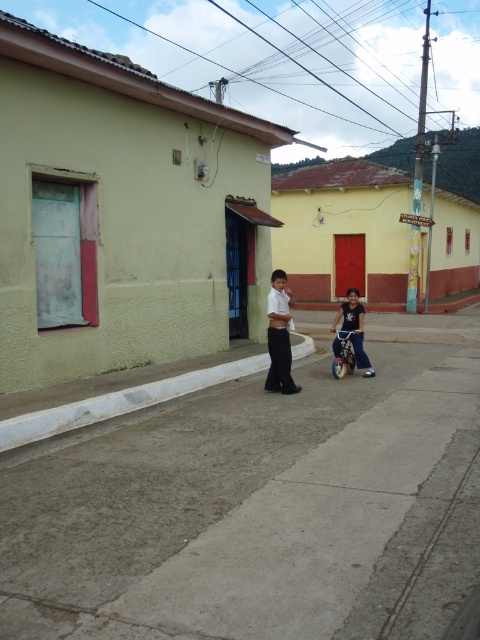
Based on the photo, does dark blue denim shorts at center appear under metallic silver stroller at center?

No, dark blue denim shorts at center is not below metallic silver stroller at center.

Describe the element at coordinates (354, 328) in the screenshot. I see `dark blue denim shorts at center` at that location.

What do you see at coordinates (354, 328) in the screenshot?
I see `dark blue denim shorts at center` at bounding box center [354, 328].

I want to click on dark blue denim shorts at center, so click(x=354, y=328).

Does gray concrete pavement at center have a smaller size compared to white concrete curb at lower center?

No.

Who is positioned more to the left, gray concrete pavement at center or white concrete curb at lower center?

From the viewer's perspective, white concrete curb at lower center appears more on the left side.

Which is in front, point (369, 620) or point (14, 435)?

Point (369, 620)

Identify the location of gray concrete pavement at center. (261, 506).

Can you confirm if gray concrete pavement at center is taller than dark blue denim shorts at center?

No, gray concrete pavement at center is not taller than dark blue denim shorts at center.

Is point (277, 417) closer to camera compared to point (362, 308)?

That is True.

In the scene shown: Who is more distant from viewer, [360,416] or [336,339]?

The point [336,339] is more distant.

In order to click on gray concrete pavement at center in this screenshot , I will do `click(261, 506)`.